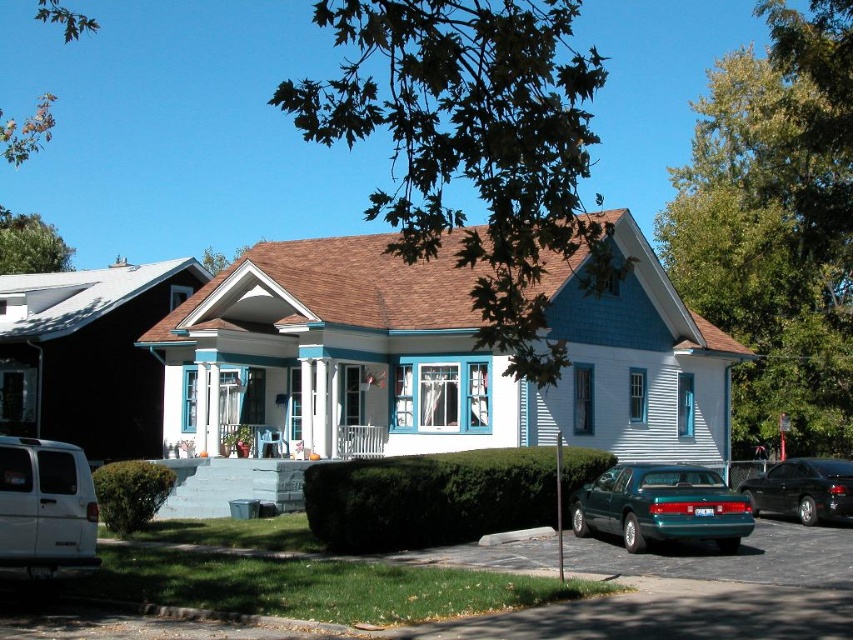
You are standing in front of the house and see both the teal glossy sedan at lower right and the shiny black sedan at lower right. Which one is closer to the house entrance?

The teal glossy sedan at lower right is closer to the house entrance because it is positioned to the left of the shiny black sedan at lower right, which is further away from the entrance.

You are a delivery driver who needs to park your vehicle in the driveway of the house shown. The driveway is narrow and can only accommodate one vehicle at a time. You have a white matte van at lower left and a shiny black sedan at lower right. Which vehicle should you choose to ensure it fits in the driveway?

The white matte van at lower left is smaller than the shiny black sedan at lower right, so you should choose the white matte van at lower left to ensure it fits in the narrow driveway.

You are standing at the front entrance of the house and see two points marked on the image. The first point is at coordinate point(84,557) and the second is at point(793,497). Which point is closer to you?

Point(84,557) is closer to you because it is in front of point(793,497).